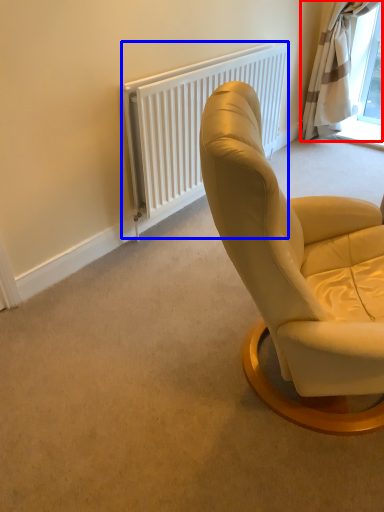
Question: Which of the following is the farthest to the observer, curtain (highlighted by a red box) or radiator (highlighted by a blue box)?

Choices:
 (A) curtain
 (B) radiator

Answer: (A)